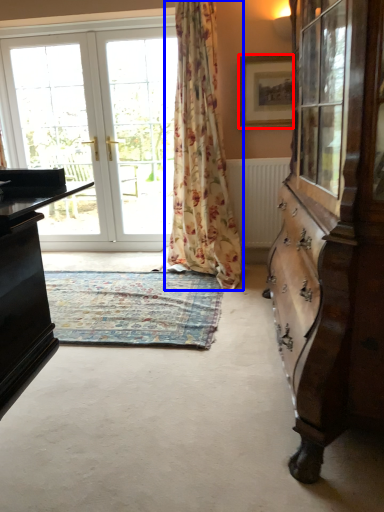
Question: Which of the following is the closest to the observer, picture frame (highlighted by a red box) or curtain (highlighted by a blue box)?

Choices:
 (A) picture frame
 (B) curtain

Answer: (B)